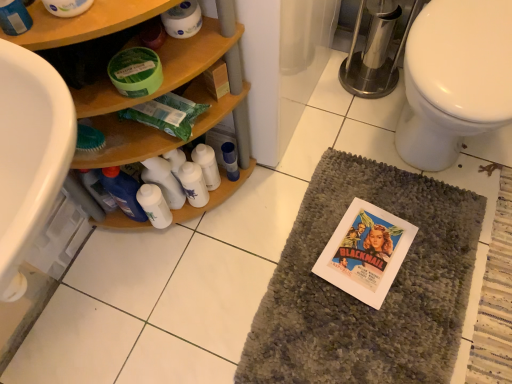
Identify the location of vacant space that's between white matte lotion at center, marked as the 2th toiletry in a right-to-left arrangement, and gray textured bath mat at center. The height and width of the screenshot is (384, 512). (241, 243).